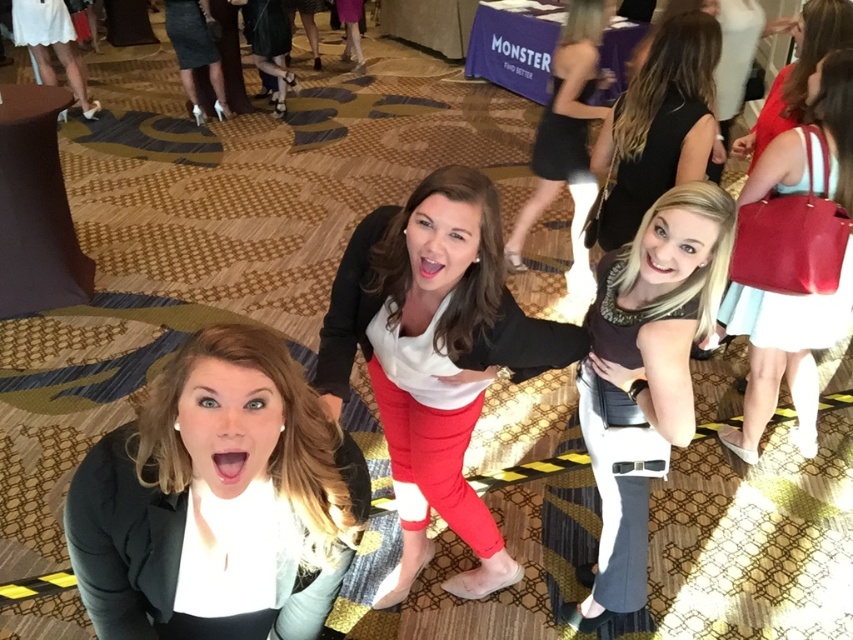
You are standing in the conference room and see the white matte shirt at center and the matte black purse at upper right. Which object is nearer to you?

The white matte shirt at center is closer to the viewer than the matte black purse at upper right.

You are organizing a photo shoot and need to ensure that the black matte blazer at lower left and the matte red handbag at right are both visible in the frame. Based on their positions, which object is closer to the bottom edge of the photo?

The black matte blazer at lower left is closer to the bottom edge of the photo because it is positioned below the matte red handbag at right.